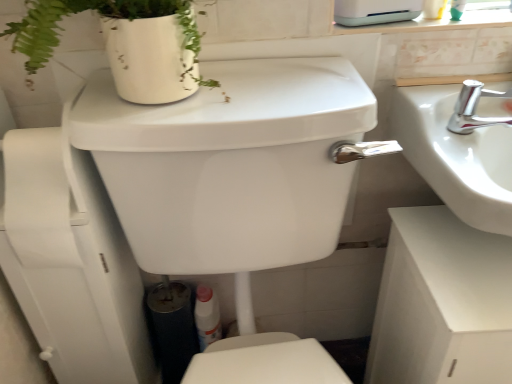
Question: Is white glossy appliance at upper center surrounding silver metallic faucet at upper right?

Choices:
 (A) no
 (B) yes

Answer: (A)

Question: Can you confirm if white glossy appliance at upper center is wider than silver metallic faucet at upper right?

Choices:
 (A) no
 (B) yes

Answer: (A)

Question: Is white glossy appliance at upper center positioned before silver metallic faucet at upper right?

Choices:
 (A) yes
 (B) no

Answer: (A)

Question: Would you say white glossy appliance at upper center is outside silver metallic faucet at upper right?

Choices:
 (A) yes
 (B) no

Answer: (A)

Question: Is white glossy appliance at upper center positioned with its back to silver metallic faucet at upper right?

Choices:
 (A) no
 (B) yes

Answer: (A)

Question: Is white plastic bottle at lower center inside or outside of white glossy sink at right?

Choices:
 (A) inside
 (B) outside

Answer: (B)

Question: Considering the positions of point (220, 327) and point (492, 107), is point (220, 327) closer or farther from the camera than point (492, 107)?

Choices:
 (A) farther
 (B) closer

Answer: (A)

Question: Considering the positions of white plastic bottle at lower center and white glossy sink at right in the image, is white plastic bottle at lower center bigger or smaller than white glossy sink at right?

Choices:
 (A) small
 (B) big

Answer: (A)

Question: Considering the positions of white plastic bottle at lower center and white glossy sink at right in the image, is white plastic bottle at lower center taller or shorter than white glossy sink at right?

Choices:
 (A) short
 (B) tall

Answer: (B)

Question: Is point pyautogui.click(x=456, y=122) positioned closer to the camera than point pyautogui.click(x=389, y=3)?

Choices:
 (A) closer
 (B) farther

Answer: (A)

Question: From their relative heights in the image, would you say silver metallic faucet at upper right is taller or shorter than white glossy appliance at upper center?

Choices:
 (A) tall
 (B) short

Answer: (B)

Question: In terms of width, does silver metallic faucet at upper right look wider or thinner when compared to white glossy appliance at upper center?

Choices:
 (A) wide
 (B) thin

Answer: (A)

Question: In the image, is silver metallic faucet at upper right on the left side or the right side of white glossy appliance at upper center?

Choices:
 (A) right
 (B) left

Answer: (A)

Question: In terms of width, does white plastic bottle at lower center look wider or thinner when compared to white glossy appliance at upper center?

Choices:
 (A) thin
 (B) wide

Answer: (A)

Question: Considering their positions, is white plastic bottle at lower center located in front of or behind white glossy appliance at upper center?

Choices:
 (A) front
 (B) behind

Answer: (B)